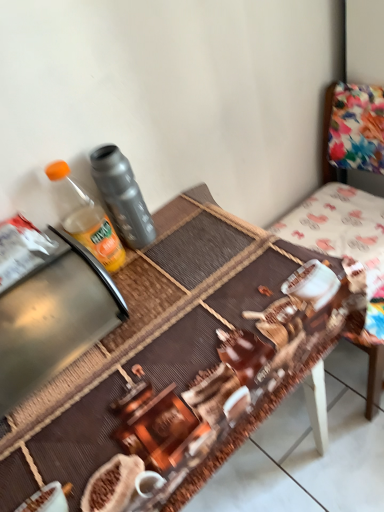
Question: From the image's perspective, is translucent plastic bottle at upper left, acting as the 1th bottle starting from the left, under metallic stainless steel appliance at left?

Choices:
 (A) yes
 (B) no

Answer: (B)

Question: Does translucent plastic bottle at upper left, acting as the 1th bottle starting from the left, have a smaller size compared to metallic stainless steel appliance at left?

Choices:
 (A) no
 (B) yes

Answer: (B)

Question: Is translucent plastic bottle at upper left, acting as the 1th bottle starting from the left, wider than metallic stainless steel appliance at left?

Choices:
 (A) yes
 (B) no

Answer: (B)

Question: Can you confirm if translucent plastic bottle at upper left, acting as the 1th bottle starting from the left, is shorter than metallic stainless steel appliance at left?

Choices:
 (A) yes
 (B) no

Answer: (B)

Question: Can you confirm if translucent plastic bottle at upper left, acting as the 1th bottle starting from the left, is taller than metallic stainless steel appliance at left?

Choices:
 (A) yes
 (B) no

Answer: (A)

Question: From the image's perspective, is metallic stainless steel appliance at left located above or below matte gray thermos at left, the 1th bottle viewed from the right?

Choices:
 (A) below
 (B) above

Answer: (A)

Question: Is metallic stainless steel appliance at left taller or shorter than matte gray thermos at left, the 2th bottle when ordered from left to right?

Choices:
 (A) short
 (B) tall

Answer: (A)

Question: In terms of width, does metallic stainless steel appliance at left look wider or thinner when compared to matte gray thermos at left, the 2th bottle when ordered from left to right?

Choices:
 (A) wide
 (B) thin

Answer: (A)

Question: From a real-world perspective, relative to matte gray thermos at left, the 2th bottle when ordered from left to right, is metallic stainless steel appliance at left vertically above or below?

Choices:
 (A) above
 (B) below

Answer: (B)

Question: Is translucent plastic bottle at upper left, acting as the 1th bottle starting from the left, wider or thinner than brown woven mat at center?

Choices:
 (A) thin
 (B) wide

Answer: (A)

Question: In the image, is translucent plastic bottle at upper left, arranged as the second bottle when viewed from the right, on the left side or the right side of brown woven mat at center?

Choices:
 (A) right
 (B) left

Answer: (B)

Question: From the image's perspective, is translucent plastic bottle at upper left, arranged as the second bottle when viewed from the right, located above or below brown woven mat at center?

Choices:
 (A) below
 (B) above

Answer: (B)

Question: Is translucent plastic bottle at upper left, arranged as the second bottle when viewed from the right, inside the boundaries of brown woven mat at center, or outside?

Choices:
 (A) outside
 (B) inside

Answer: (A)

Question: Considering the positions of translucent plastic bottle at upper left, arranged as the second bottle when viewed from the right, and floral fabric chair at upper right in the image, is translucent plastic bottle at upper left, arranged as the second bottle when viewed from the right, bigger or smaller than floral fabric chair at upper right?

Choices:
 (A) big
 (B) small

Answer: (B)

Question: Is point (77, 222) closer or farther from the camera than point (322, 180)?

Choices:
 (A) closer
 (B) farther

Answer: (A)